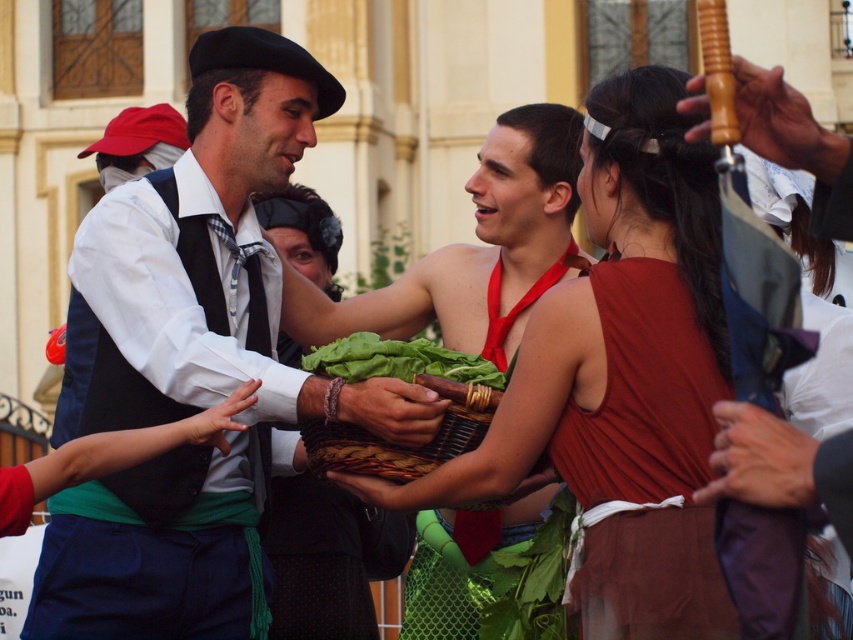
Question: Does matte black vest at center appear over woven brown basket at center?

Choices:
 (A) yes
 (B) no

Answer: (A)

Question: Can you confirm if green fabric skirt at center is positioned below woven brown basket at center?

Choices:
 (A) no
 (B) yes

Answer: (A)

Question: Among these objects, which one is nearest to the camera?

Choices:
 (A) woven brown basket at center
 (B) green fabric skirt at center
 (C) matte black vest at center
 (D) matte red dress at center

Answer: (D)

Question: Which point appears closest to the camera in this image?

Choices:
 (A) (445, 440)
 (B) (396, 412)
 (C) (608, 611)

Answer: (C)

Question: Which point appears farthest from the camera in this image?

Choices:
 (A) (149, 264)
 (B) (454, 445)

Answer: (A)

Question: Is matte red dress at center above woven brown basket at center?

Choices:
 (A) yes
 (B) no

Answer: (A)